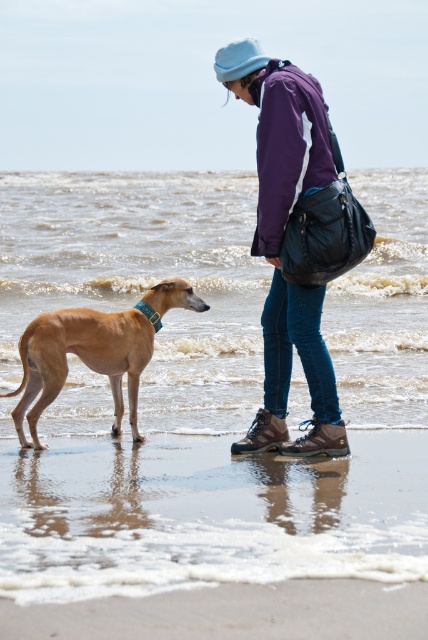
Is point (388, 573) closer to viewer compared to point (20, 420)?

Yes.

Who is positioned more to the left, smooth sand at lower center or brown smooth dog at lower left?

brown smooth dog at lower left is more to the left.

Where is `smooth sand at lower center`? The width and height of the screenshot is (428, 640). smooth sand at lower center is located at coordinates (214, 538).

Can you confirm if smooth sand at lower center is taller than purple matte jacket at center?

Incorrect, smooth sand at lower center's height is not larger of purple matte jacket at center's.

Between point (128, 566) and point (261, 218), which one is positioned behind?

Positioned behind is point (261, 218).

At what (x,y) coordinates should I click in order to perform the action: click on smooth sand at lower center. Please return your answer as a coordinate pair (x, y). The width and height of the screenshot is (428, 640). Looking at the image, I should click on (214, 538).

Who is shorter, purple matte jacket at center or brown smooth dog at lower left?

Standing shorter between the two is brown smooth dog at lower left.

Between purple matte jacket at center and brown smooth dog at lower left, which one is positioned lower?

brown smooth dog at lower left is below.

Is point (253, 38) behind point (118, 321)?

No, (253, 38) is closer to viewer.

At what (x,y) coordinates should I click in order to perform the action: click on purple matte jacket at center. Please return your answer as a coordinate pair (x, y). This screenshot has height=640, width=428. Looking at the image, I should click on (281, 241).